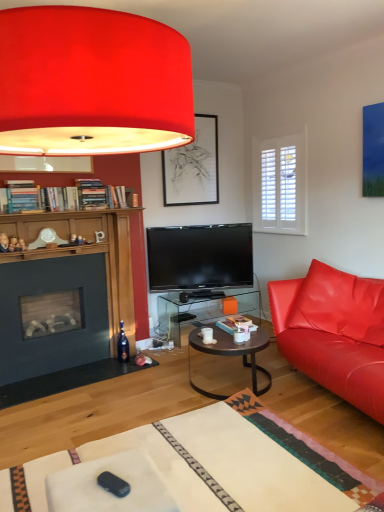
This screenshot has height=512, width=384. I want to click on free spot to the left of black plastic remote control at lower center, so click(x=86, y=494).